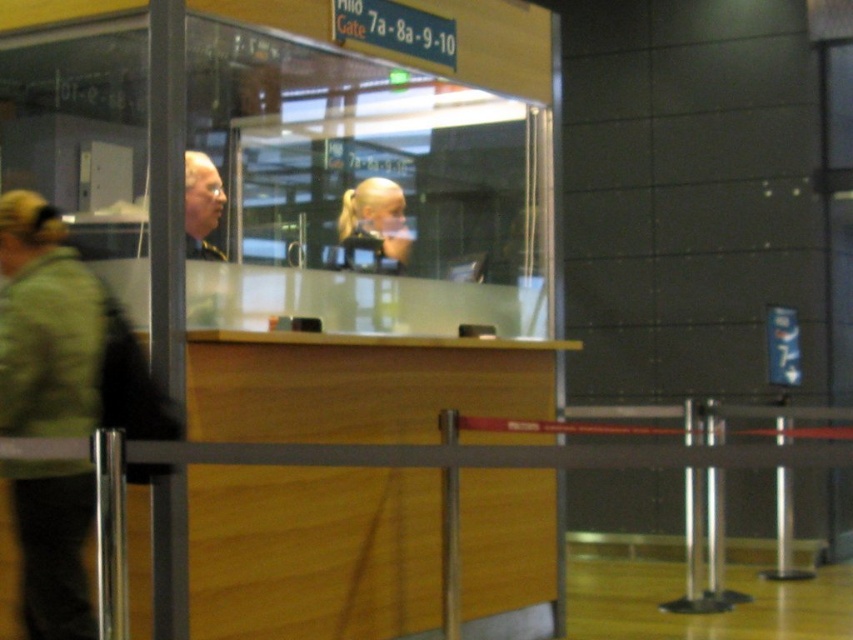
Question: Which is nearer to the blonde hair ponytail at center?

Choices:
 (A) light brown wood desk at center
 (B) green fabric jacket at left
 (C) matte black hair at center

Answer: (C)

Question: Where is light brown wood desk at center located in relation to matte black hair at center in the image?

Choices:
 (A) below
 (B) above

Answer: (A)

Question: Does light brown wood desk at center come behind green fabric jacket at left?

Choices:
 (A) yes
 (B) no

Answer: (A)

Question: Does light brown wood desk at center appear on the right side of green fabric jacket at left?

Choices:
 (A) yes
 (B) no

Answer: (A)

Question: Which is farther from the green fabric jacket at left?

Choices:
 (A) matte black hair at center
 (B) blonde hair ponytail at center

Answer: (B)

Question: Estimate the real-world distances between objects in this image. Which object is farther from the green fabric jacket at left?

Choices:
 (A) matte black hair at center
 (B) blonde hair ponytail at center
 (C) light brown wood desk at center

Answer: (B)